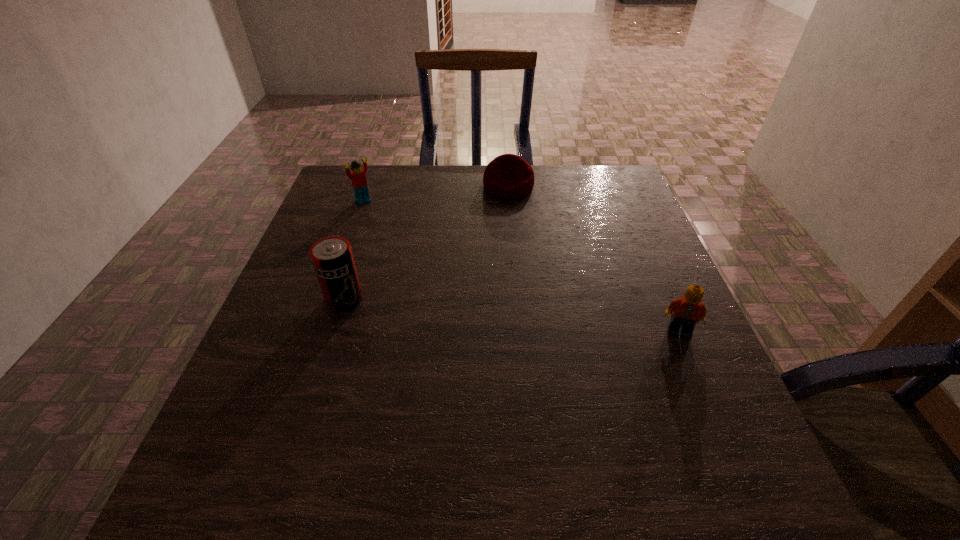
The image size is (960, 540). I want to click on object at the far left corner, so click(358, 178).

Locate an element on the screen. Image resolution: width=960 pixels, height=540 pixels. free region at the far edge of the desktop is located at coordinates (570, 200).

Where is `vacant area at the left edge`? The height and width of the screenshot is (540, 960). vacant area at the left edge is located at coordinates (284, 367).

What are the coordinates of `free space at the right edge of the desktop` in the screenshot? It's located at (621, 219).

Find the location of a particular element. vacant space at the far left corner of the desktop is located at coordinates (389, 169).

Identify the location of vacant space at the near left corner of the desktop. (248, 411).

You are a GUI agent. You are given a task and a screenshot of the screen. Output one action in this format:
    pyautogui.click(x=<x>, y=<y>)
    Task: Click on the vacant region at the far right corner of the desktop
    This screenshot has width=960, height=540.
    Given the screenshot: What is the action you would take?
    pyautogui.click(x=589, y=194)

Locate an element on the screen. The height and width of the screenshot is (540, 960). free spot between the nearest object and the shortest object is located at coordinates (593, 259).

What are the coordinates of `free spot between the tallest object and the left Lego` in the screenshot? It's located at [354, 250].

Locate an element on the screen. empty space between the second nearest object and the left Lego is located at coordinates (354, 250).